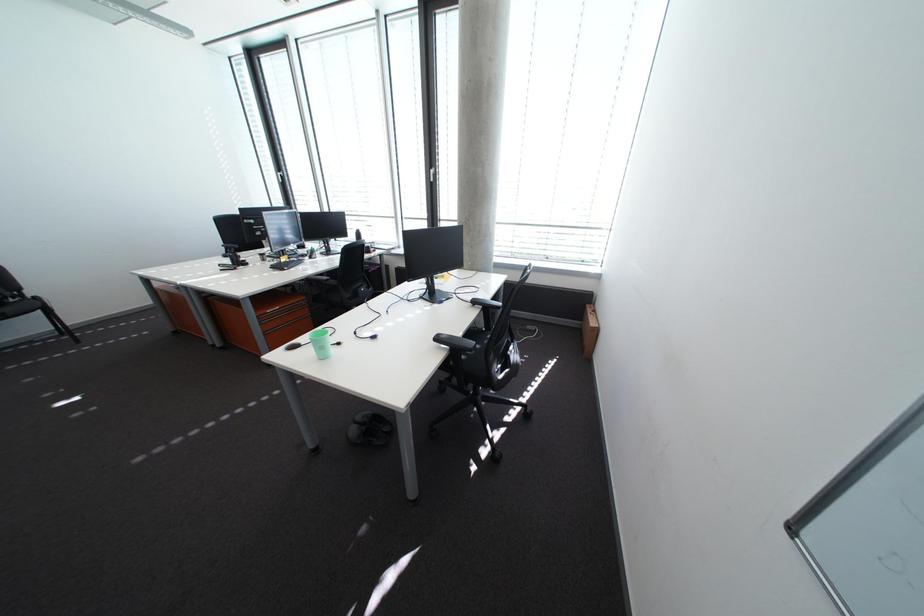
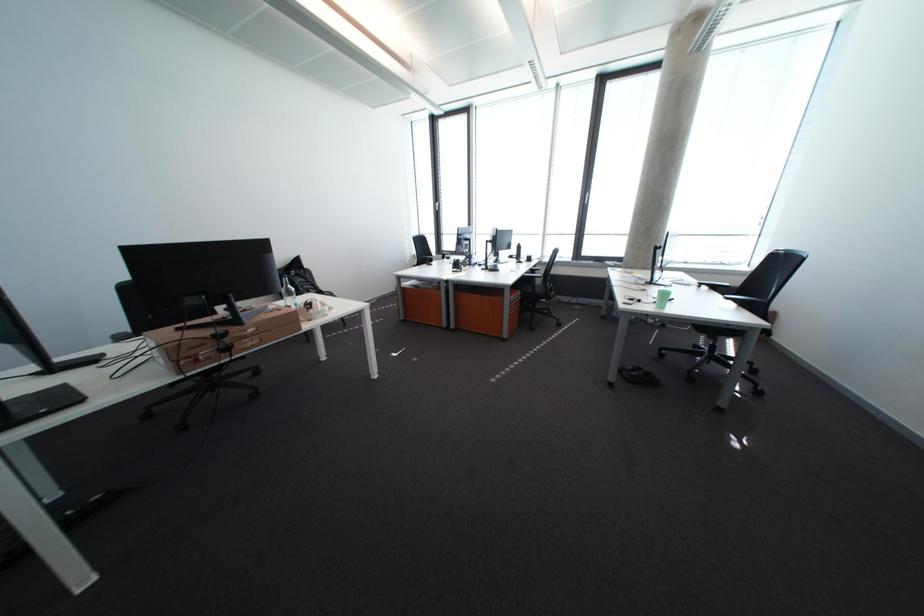
From the picture: In a continuous first-person perspective shot, in which direction is the camera moving?

The movement direction of the cameraman is left, backward.